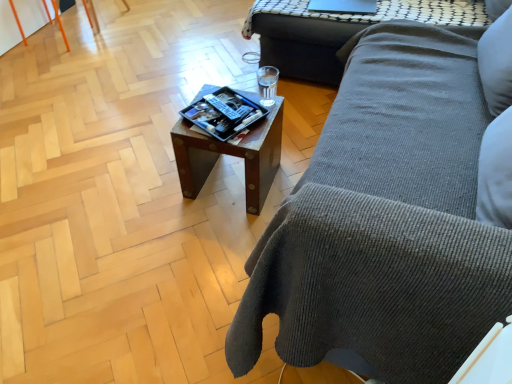
Identify the location of vacant area on the back side of orange plastic chair at upper left. (75, 19).